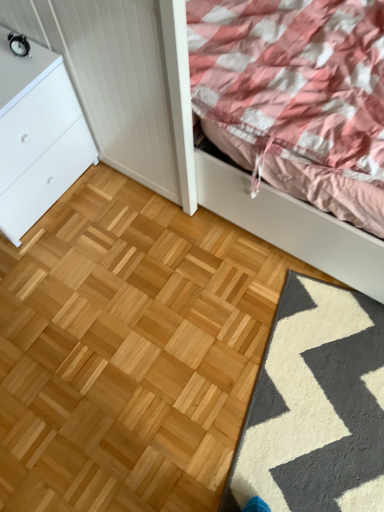
This screenshot has width=384, height=512. In order to click on white matte chest of drawers at upper left in this screenshot , I will do `click(37, 136)`.

This screenshot has width=384, height=512. What do you see at coordinates (37, 136) in the screenshot?
I see `white matte chest of drawers at upper left` at bounding box center [37, 136].

You are a GUI agent. You are given a task and a screenshot of the screen. Output one action in this format:
    pyautogui.click(x=<x>, y=<y>)
    Task: Click on the white matte chest of drawers at upper left
    
    Given the screenshot: What is the action you would take?
    pyautogui.click(x=37, y=136)